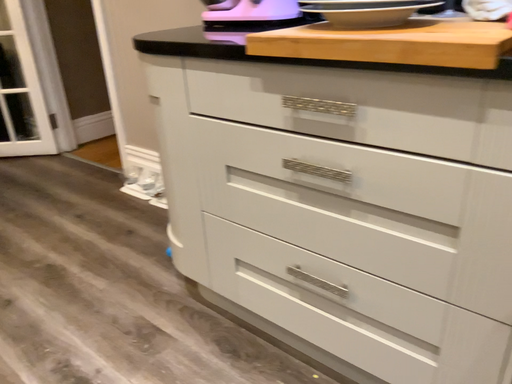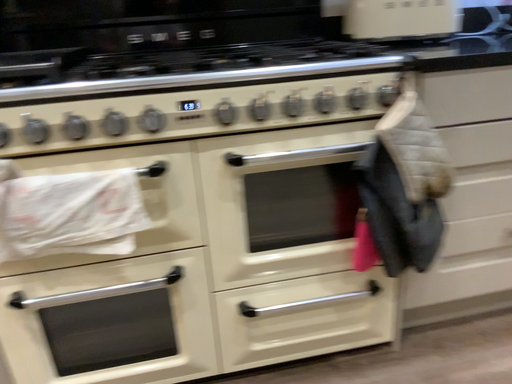
Question: How did the camera likely rotate when shooting the video?

Choices:
 (A) rotated right
 (B) rotated left

Answer: (A)